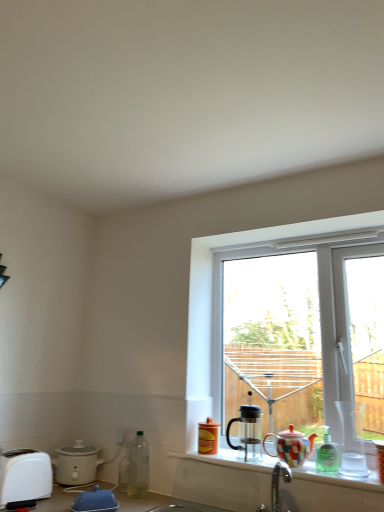
Question: Considering the relative positions of multicolored ceramic coffee cup at right, which is the first coffee cup in right-to-left order, and multicolored ceramic teapot at window in the image provided, is multicolored ceramic coffee cup at right, which is the first coffee cup in right-to-left order, to the right of multicolored ceramic teapot at window from the viewer's perspective?

Choices:
 (A) yes
 (B) no

Answer: (A)

Question: Can you confirm if multicolored ceramic coffee cup at right, the 3th coffee cup positioned from the left, is positioned to the left of multicolored ceramic teapot at window?

Choices:
 (A) yes
 (B) no

Answer: (B)

Question: Is multicolored ceramic coffee cup at right, which is the first coffee cup in right-to-left order, thinner than multicolored ceramic teapot at window?

Choices:
 (A) no
 (B) yes

Answer: (B)

Question: From a real-world perspective, is multicolored ceramic coffee cup at right, which is the first coffee cup in right-to-left order, positioned over multicolored ceramic teapot at window based on gravity?

Choices:
 (A) no
 (B) yes

Answer: (A)

Question: Is multicolored ceramic coffee cup at right, the 3th coffee cup positioned from the left, directly adjacent to multicolored ceramic teapot at window?

Choices:
 (A) yes
 (B) no

Answer: (B)

Question: Is clear plastic bottle at lower left, which ranks as the third bottle in right-to-left order, not close to matte white slow cooker at lower left?

Choices:
 (A) no
 (B) yes

Answer: (A)

Question: Is clear plastic bottle at lower left, the 1th bottle when ordered from left to right, aimed at matte white slow cooker at lower left?

Choices:
 (A) no
 (B) yes

Answer: (A)

Question: Does clear plastic bottle at lower left, which ranks as the third bottle in right-to-left order, have a lesser height compared to matte white slow cooker at lower left?

Choices:
 (A) yes
 (B) no

Answer: (B)

Question: Considering the relative sizes of clear plastic bottle at lower left, which ranks as the third bottle in right-to-left order, and matte white slow cooker at lower left in the image provided, is clear plastic bottle at lower left, which ranks as the third bottle in right-to-left order, taller than matte white slow cooker at lower left?

Choices:
 (A) yes
 (B) no

Answer: (A)

Question: Does clear plastic bottle at lower left, the 1th bottle when ordered from left to right, come behind matte white slow cooker at lower left?

Choices:
 (A) no
 (B) yes

Answer: (A)

Question: Does clear plastic bottle at lower left, which ranks as the third bottle in right-to-left order, have a greater width compared to matte white slow cooker at lower left?

Choices:
 (A) yes
 (B) no

Answer: (B)

Question: Considering the relative sizes of white plastic electric outlet at lower left and transparent plastic window at center in the image provided, is white plastic electric outlet at lower left wider than transparent plastic window at center?

Choices:
 (A) no
 (B) yes

Answer: (A)